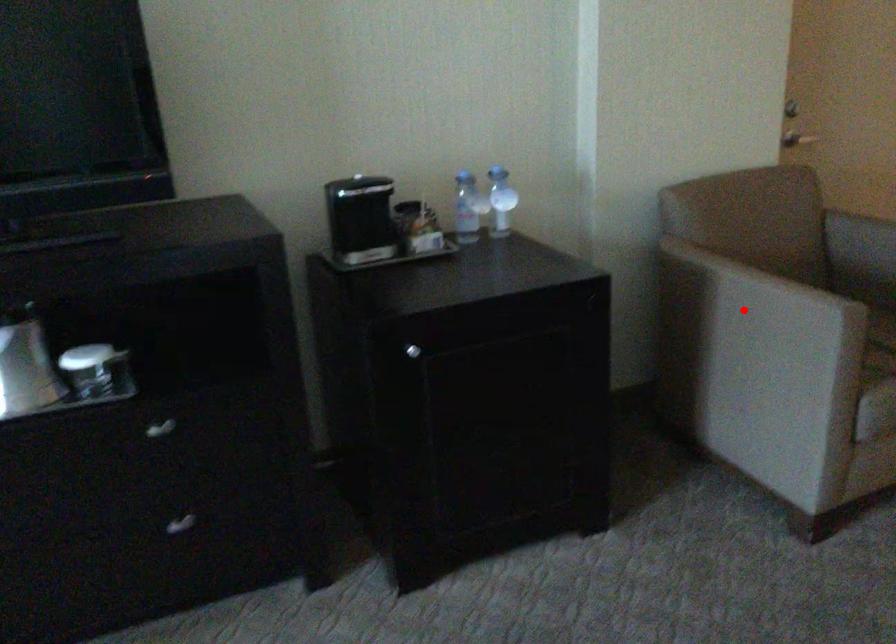
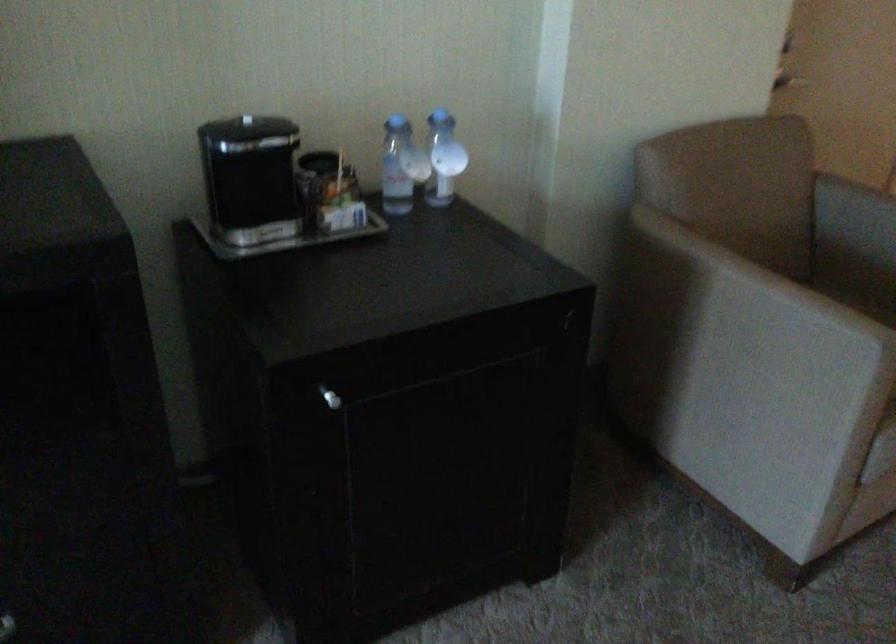
The point at the highlighted location is marked in the first image. Where is the corresponding point in the second image?

(739, 319)